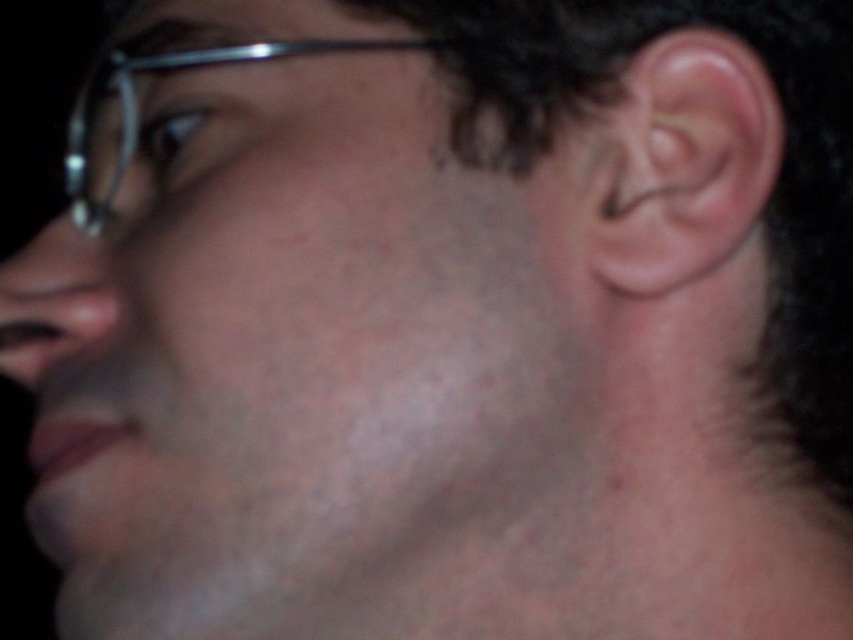
Question: Does pinkish skin ear at right have a smaller size compared to metallic frame glasses at upper left?

Choices:
 (A) no
 (B) yes

Answer: (B)

Question: Does pinkish skin ear at right appear under metallic frame glasses at upper left?

Choices:
 (A) yes
 (B) no

Answer: (A)

Question: Which object appears closest to the camera in this image?

Choices:
 (A) metallic frame glasses at upper left
 (B) pinkish skin ear at right

Answer: (A)

Question: Does pinkish skin ear at right appear over metallic frame glasses at upper left?

Choices:
 (A) no
 (B) yes

Answer: (A)